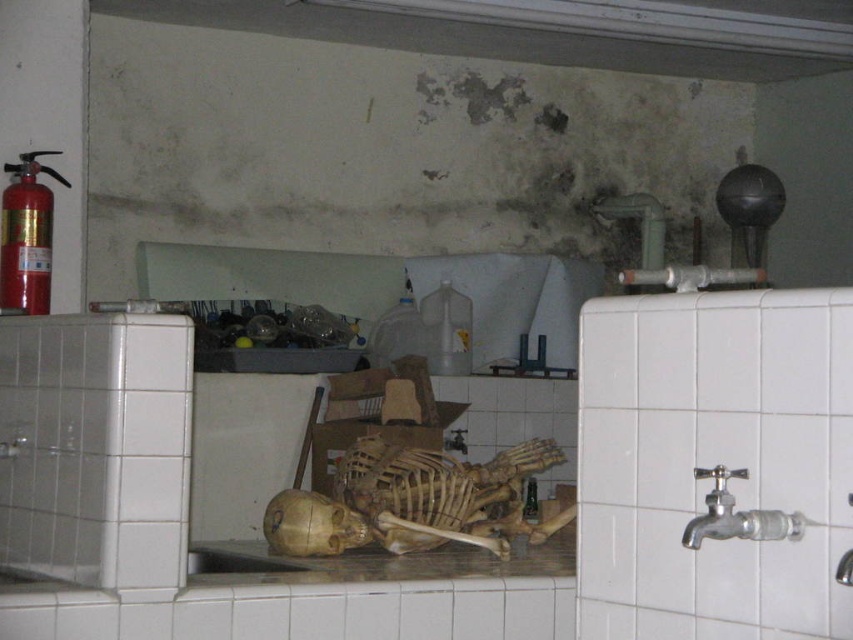
You are a plumber inspecting the kitchen. You see the brown wooden skeleton at center and the silver metallic faucet at right. Which object is positioned lower in the image?

The brown wooden skeleton at center is located below the silver metallic faucet at right, so it is positioned lower in the image.

You are a home inspector assessing the kitchen. You notice the wooden skeleton at center and the silver metallic faucet at right. Which object is closer to the left side of the kitchen?

The wooden skeleton at center is positioned on the left side of the silver metallic faucet at right, so it is closer to the left side of the kitchen.